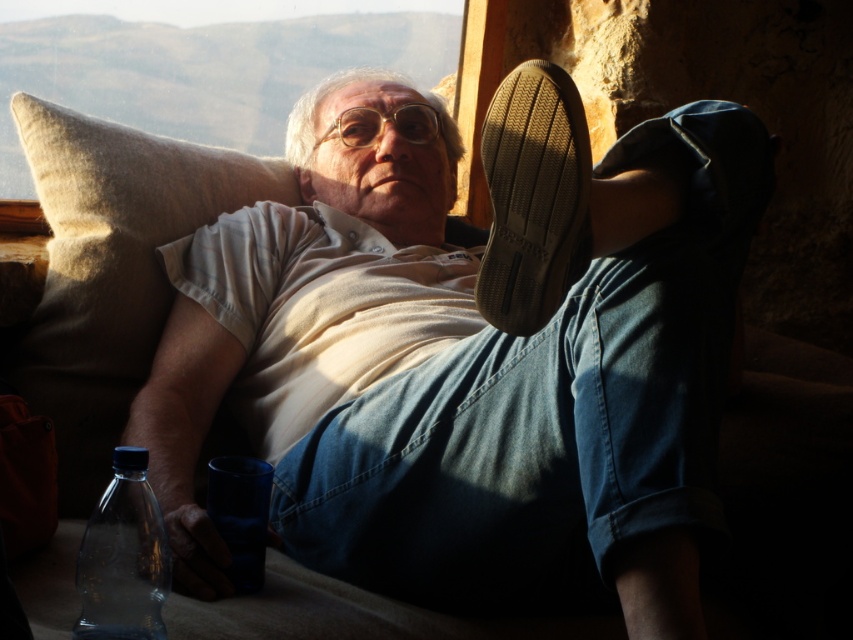
Question: Estimate the real-world distances between objects in this image. Which object is farther from the brown leather shoe at upper right?

Choices:
 (A) transparent glass window at upper center
 (B) matte brown shoe at upper center
 (C) transparent plastic bottle at lower left

Answer: (A)

Question: Which point is farther to the camera?

Choices:
 (A) [x=106, y=637]
 (B) [x=625, y=467]

Answer: (B)

Question: Is matte brown shoe at upper center in front of transparent plastic bottle at lower left?

Choices:
 (A) yes
 (B) no

Answer: (B)

Question: Is matte brown shoe at upper center below transparent glass window at upper center?

Choices:
 (A) no
 (B) yes

Answer: (B)

Question: Which point is farther to the camera?

Choices:
 (A) (548, 132)
 (B) (529, 301)

Answer: (B)

Question: Considering the relative positions of brown leather shoe at upper right and transparent plastic bottle at lower left in the image provided, where is brown leather shoe at upper right located with respect to transparent plastic bottle at lower left?

Choices:
 (A) above
 (B) below

Answer: (A)